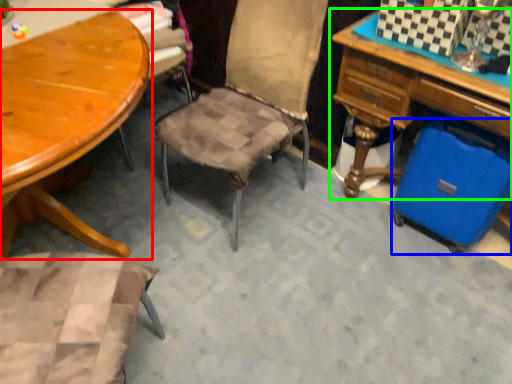
Question: Based on their relative distances, which object is nearer to table (highlighted by a red box)? Choose from luggage (highlighted by a blue box) and desk (highlighted by a green box).

Choices:
 (A) luggage
 (B) desk

Answer: (B)